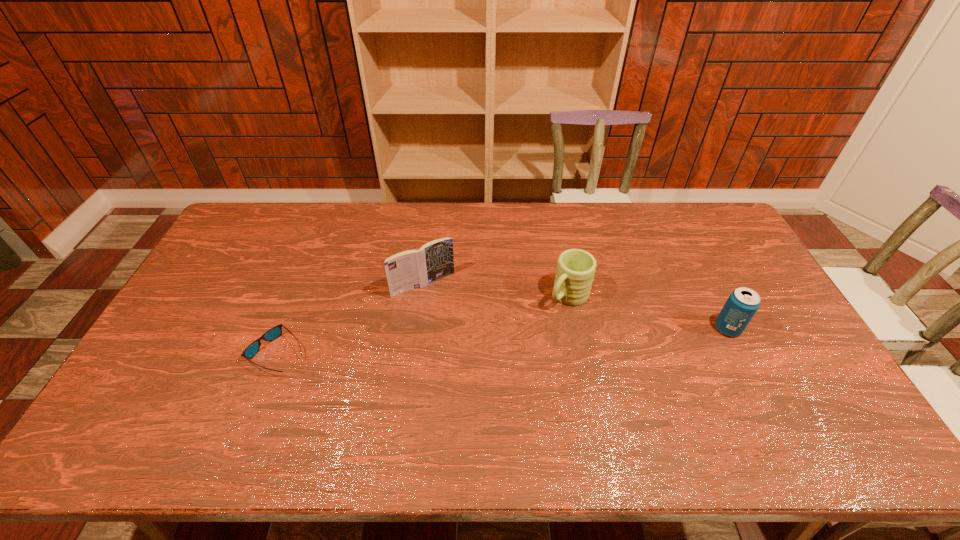
Where is `free spot between the shortest object and the third object from right to left`? This screenshot has height=540, width=960. free spot between the shortest object and the third object from right to left is located at coordinates (351, 319).

Find the location of a particular element. The image size is (960, 540). empty space between the second object from right to left and the shortest object is located at coordinates (423, 325).

Find the location of a particular element. This screenshot has width=960, height=540. the third closest object relative to the book is located at coordinates click(x=742, y=304).

Identify which object is located as the second nearest to the rightmost object. Please provide its 2D coordinates. Your answer should be formatted as a tuple, i.e. [(x, y)], where the tuple contains the x and y coordinates of a point satisfying the conditions above.

[(412, 269)]

Where is `vacant space that satisfies the following two spatial constraints: 1. on the front side of the third object from left to right; 2. on the right side of the second object from left to right`? The image size is (960, 540). vacant space that satisfies the following two spatial constraints: 1. on the front side of the third object from left to right; 2. on the right side of the second object from left to right is located at coordinates (422, 296).

This screenshot has height=540, width=960. What are the coordinates of `free location that satisfies the following two spatial constraints: 1. on the front side of the third object from left to right; 2. on the right side of the rightmost object` in the screenshot? It's located at (575, 328).

Identify the location of vacant area in the image that satisfies the following two spatial constraints: 1. on the front side of the soda can; 2. on the left side of the third object from left to right. The width and height of the screenshot is (960, 540). (575, 328).